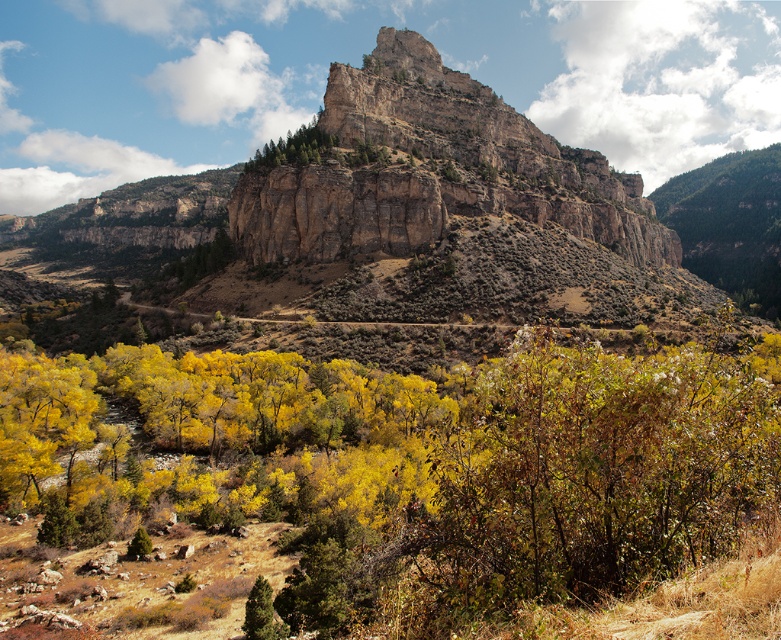
Question: Is rugged stone mountain at center to the right of green textured pine tree at upper center from the viewer's perspective?

Choices:
 (A) no
 (B) yes

Answer: (B)

Question: Which of the following is the farthest from the observer?

Choices:
 (A) green textured pine tree at upper center
 (B) yellow leafy tree at center
 (C) rugged stone mountain at center
 (D) rugged brown cliff at center

Answer: (A)

Question: Is yellow leafy tree at center above rugged stone mountain at center?

Choices:
 (A) yes
 (B) no

Answer: (B)

Question: Among these objects, which one is nearest to the camera?

Choices:
 (A) rugged stone mountain at center
 (B) green textured pine tree at upper center
 (C) rugged brown cliff at center
 (D) yellow leafy tree at center

Answer: (D)

Question: Considering the relative positions of yellow leafy tree at center and rugged stone mountain at center in the image provided, where is yellow leafy tree at center located with respect to rugged stone mountain at center?

Choices:
 (A) right
 (B) left

Answer: (B)

Question: Which object is the farthest from the rugged brown cliff at center?

Choices:
 (A) green textured pine tree at upper center
 (B) yellow leafy tree at center
 (C) rugged stone mountain at center

Answer: (C)